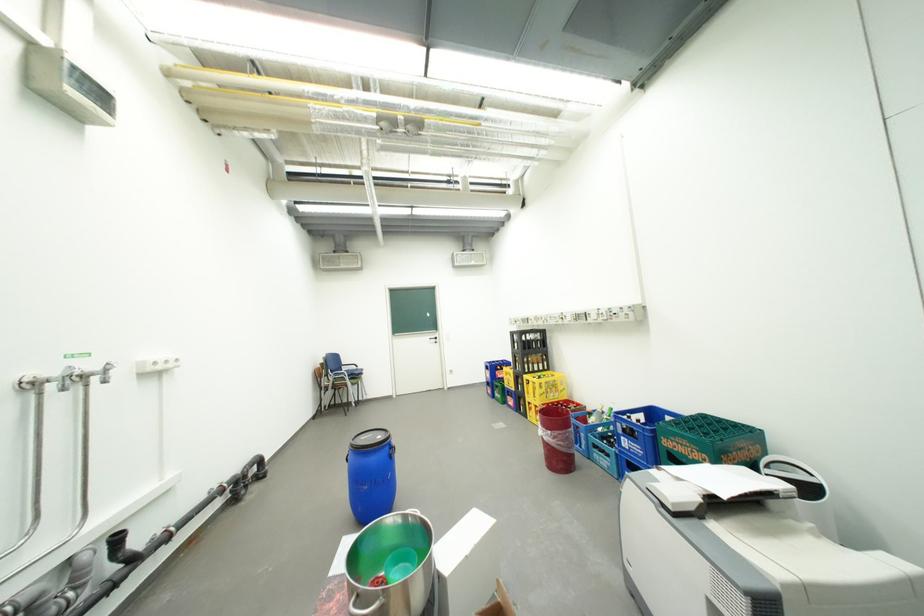
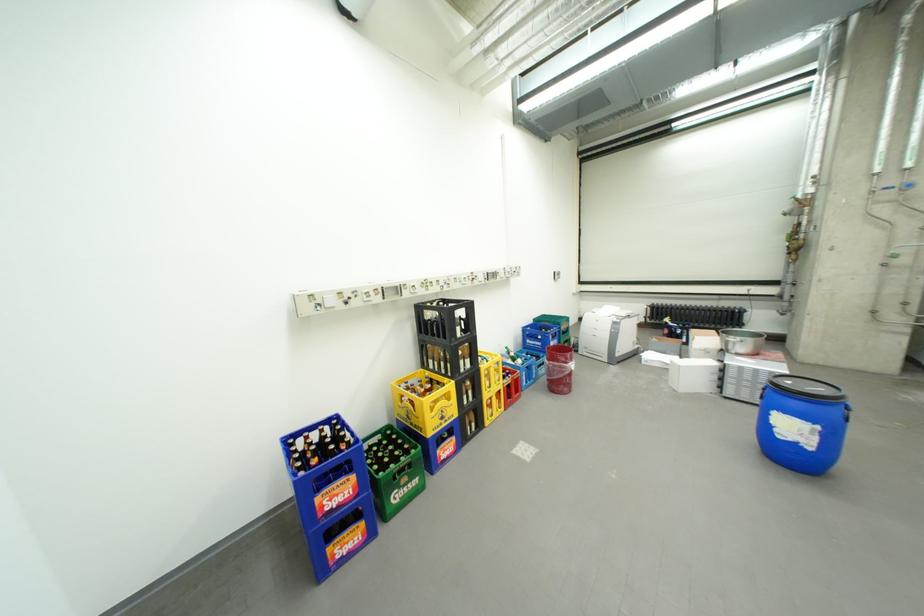
Locate, in the second image, the point that corresponds to point 390,438 in the first image.

(799, 383)